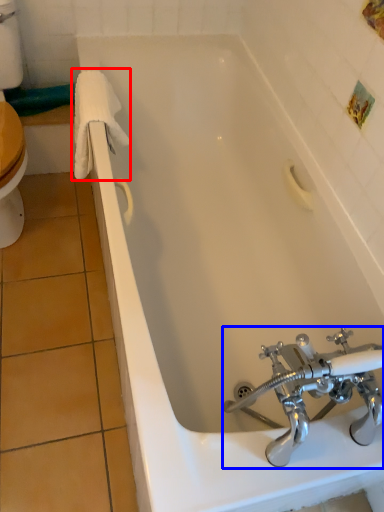
Question: Which of the following is the closest to the observer, bath towel (highlighted by a red box) or tap (highlighted by a blue box)?

Choices:
 (A) bath towel
 (B) tap

Answer: (B)